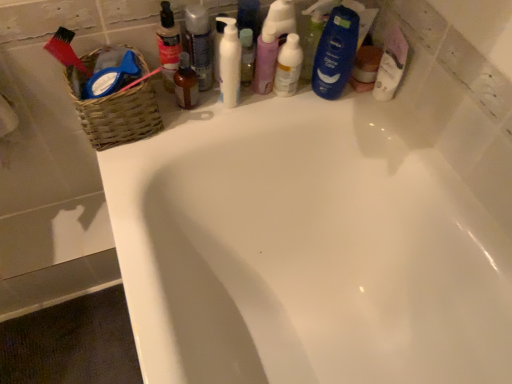
What are the coordinates of `vacant space to the right of woven brown basket at upper left` in the screenshot? It's located at (194, 117).